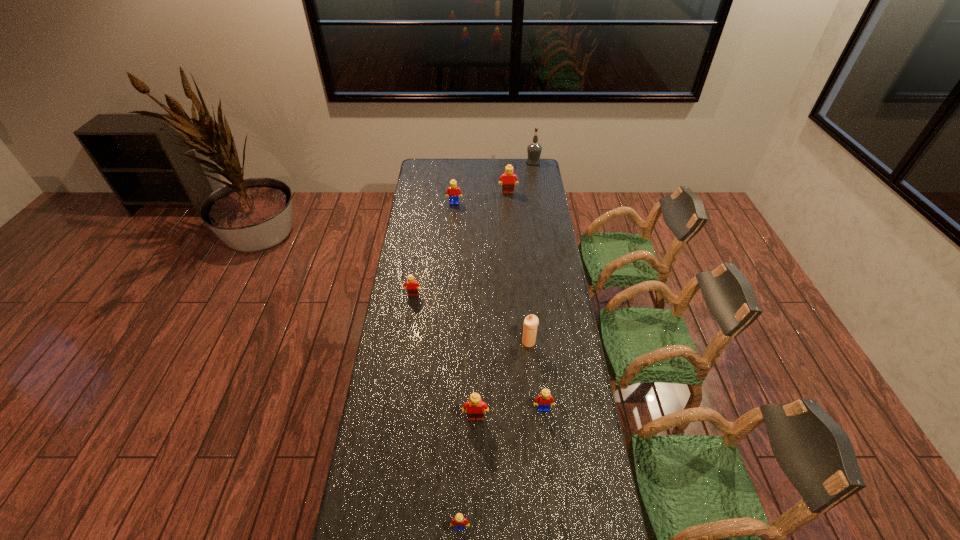
Locate an element on the screen. The image size is (960, 540). vacant space at the far edge of the desktop is located at coordinates (500, 162).

Image resolution: width=960 pixels, height=540 pixels. I want to click on free space at the left edge, so click(390, 397).

Identify the location of free space at the right edge of the desktop. (550, 255).

In the image, there is a desktop. At what (x,y) coordinates should I click in order to perform the action: click on vacant space at the far left corner. Please return your answer as a coordinate pair (x, y). Image resolution: width=960 pixels, height=540 pixels. Looking at the image, I should click on (439, 170).

Locate an element on the screen. vacant region at the far right corner of the desktop is located at coordinates (528, 169).

This screenshot has width=960, height=540. In order to click on vacant space that is in between the farthest Lego and the second nearest brown Lego in this screenshot , I will do `click(461, 244)`.

Locate an element on the screen. Image resolution: width=960 pixels, height=540 pixels. empty space that is in between the fifth farthest object and the shortest Lego is located at coordinates (494, 435).

Where is `vacant space that's between the second farthest object and the second brown Lego from right to left`? This screenshot has height=540, width=960. vacant space that's between the second farthest object and the second brown Lego from right to left is located at coordinates (492, 306).

Find the location of a particular element. This screenshot has width=960, height=540. vacant area between the tallest Lego and the candle is located at coordinates (518, 268).

Locate an element on the screen. Image resolution: width=960 pixels, height=540 pixels. vacant area that lies between the biggest brown Lego and the vodka is located at coordinates (520, 178).